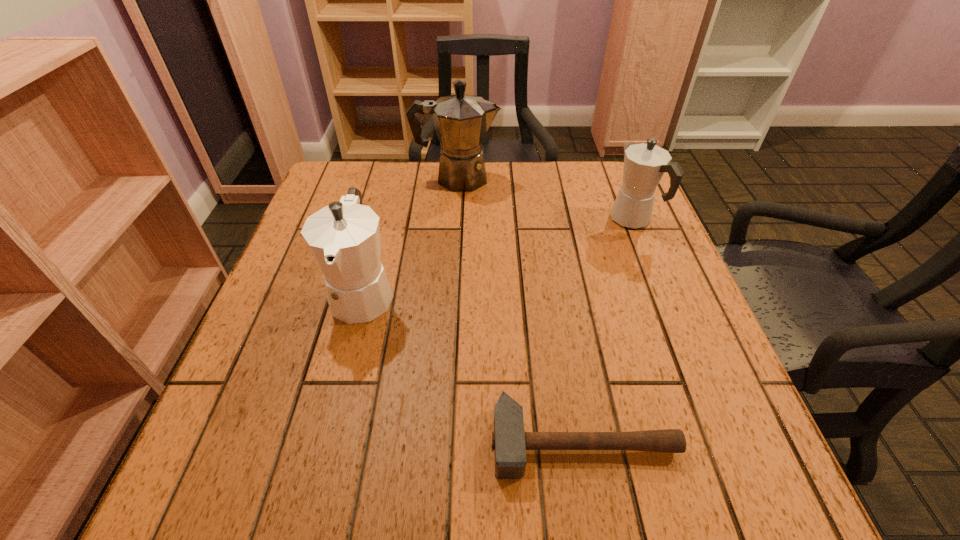
Find the location of a particular element. the farthest coffeepot is located at coordinates (461, 121).

Identify the location of the nearest coffeepot. The height and width of the screenshot is (540, 960). (344, 237).

Where is `the second farthest object`? the second farthest object is located at coordinates (644, 164).

You are a GUI agent. You are given a task and a screenshot of the screen. Output one action in this format:
    pyautogui.click(x=<x>, y=<y>)
    Task: Click on the rightmost coffeepot
    
    Given the screenshot: What is the action you would take?
    pyautogui.click(x=644, y=164)

Locate an element on the screen. hammer is located at coordinates (509, 441).

Find the location of a particular element. The width and height of the screenshot is (960, 540). the nearest object is located at coordinates (509, 441).

What are the coordinates of `vacant space situated on the pouring side of the farthest object` in the screenshot? It's located at (612, 178).

Where is `vacant space located at the spout of the nearest coffeepot`? The height and width of the screenshot is (540, 960). vacant space located at the spout of the nearest coffeepot is located at coordinates (339, 387).

This screenshot has height=540, width=960. What are the coordinates of `free space located 0.180m on the back of the rightmost coffeepot` in the screenshot? It's located at (612, 166).

Where is `object that is at the near edge`? object that is at the near edge is located at coordinates (509, 441).